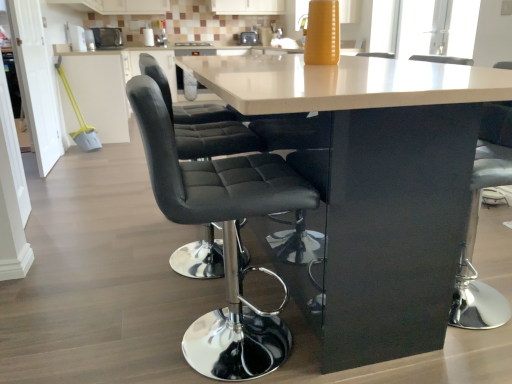
Describe the element at coordinates (374, 189) in the screenshot. Image resolution: width=512 pixels, height=384 pixels. I see `glossy black table at center` at that location.

Find the location of `metallic silver toaster at upper left, acting as the 2th appliance starting from the right`. metallic silver toaster at upper left, acting as the 2th appliance starting from the right is located at coordinates coord(106,37).

The width and height of the screenshot is (512, 384). What do you see at coordinates (100, 93) in the screenshot?
I see `white glossy cabinet at upper left` at bounding box center [100, 93].

The image size is (512, 384). Identify the location of white glossy counter at center. (109, 85).

Would you say white glossy cabinet at upper left contains black leather chair at center?

Actually, black leather chair at center is outside white glossy cabinet at upper left.

In the scene shown: From the image's perspective, which is below, white glossy cabinet at upper left or black leather chair at center?

black leather chair at center is shown below in the image.

From a real-world perspective, is white glossy cabinet at upper left below black leather chair at center?

Incorrect, from a real-world perspective, white glossy cabinet at upper left is higher than black leather chair at center.

Can you confirm if white glossy cabinet at upper left is positioned to the left of black leather chair at center?

Correct, you'll find white glossy cabinet at upper left to the left of black leather chair at center.

Based on the photo, how different are the orientations of white glossy counter at center and metallic silver toaster at center, placed as the 2th appliance when sorted from front to back, in degrees?

They differ by 0.157 degrees in their facing directions.

From a real-world perspective, is white glossy counter at center above or below metallic silver toaster at center, acting as the 1th appliance starting from the back?

In terms of real-world spatial position, white glossy counter at center is below metallic silver toaster at center, acting as the 1th appliance starting from the back.

Does white glossy counter at center touch metallic silver toaster at center, placed as the 2th appliance when sorted from front to back?

No.

Which is less distant, (68, 50) or (251, 38)?

Clearly, point (68, 50) is more distant from the camera than point (251, 38).

Does metallic silver toaster at center, arranged as the second appliance when viewed from the left, turn towards black leather chair at center?

Yes, metallic silver toaster at center, arranged as the second appliance when viewed from the left, is turned towards black leather chair at center.

Which appliance is the 1st one when counting from the left side of the black leather chair at center? Please provide its 2D coordinates.

[(249, 38)]

From the image's perspective, which one is positioned higher, metallic silver toaster at center, which is the first appliance from right to left, or black leather chair at center?

metallic silver toaster at center, which is the first appliance from right to left.

Is metallic silver toaster at center, which is the first appliance from right to left, next to black leather chair at center and touching it?

No, metallic silver toaster at center, which is the first appliance from right to left, is not touching black leather chair at center.

From the image's perspective, starting from the glossy black table at center, which appliance is the 2nd one above? Please provide its 2D coordinates.

[(249, 38)]

Which object is positioned more to the left, glossy black table at center or metallic silver toaster at center, which is the first appliance from right to left?

metallic silver toaster at center, which is the first appliance from right to left, is more to the left.

Considering the positions of points (470, 205) and (257, 40), is point (470, 205) closer to camera compared to point (257, 40)?

That is True.

Would you say metallic silver toaster at center, placed as the 2th appliance when sorted from front to back, is part of glossy black table at center's contents?

Definitely not — metallic silver toaster at center, placed as the 2th appliance when sorted from front to back, is not inside glossy black table at center.

From a real-world perspective, which object stands above the other?

metallic silver toaster at upper left, which appears as the first appliance when viewed from the front.

Is metallic silver toaster at upper left, acting as the 2th appliance starting from the right, oriented towards black leather chair at center?

No, metallic silver toaster at upper left, acting as the 2th appliance starting from the right, is not turned towards black leather chair at center.

Does metallic silver toaster at center, which is the first appliance from right to left, have a lesser width compared to white glossy cabinet at upper left?

Yes.

How far apart are metallic silver toaster at center, acting as the 1th appliance starting from the back, and white glossy cabinet at upper left?

metallic silver toaster at center, acting as the 1th appliance starting from the back, is 5.14 feet from white glossy cabinet at upper left.

Considering the sizes of objects metallic silver toaster at center, placed as the 2th appliance when sorted from front to back, and white glossy cabinet at upper left in the image provided, who is shorter, metallic silver toaster at center, placed as the 2th appliance when sorted from front to back, or white glossy cabinet at upper left?

metallic silver toaster at center, placed as the 2th appliance when sorted from front to back.

Is black leather chair at center aimed at white glossy counter at center?

No, black leather chair at center is not aimed at white glossy counter at center.

Can you confirm if black leather chair at center is positioned to the right of white glossy counter at center?

Correct, you'll find black leather chair at center to the right of white glossy counter at center.

Is black leather chair at center not close to white glossy counter at center?

Absolutely, black leather chair at center is distant from white glossy counter at center.

Locate an element on the screen. The image size is (512, 384). chair below the white glossy cabinet at upper left (from the image's perspective) is located at coordinates point(223,236).

Identify the location of counter that is in front of the metallic silver toaster at center, which is the first appliance from right to left. (109, 85).

Based on their spatial positions, is glossy black table at center or metallic silver toaster at upper left, the second appliance in the back-to-front sequence, further from white glossy cabinet at upper left?

glossy black table at center is further to white glossy cabinet at upper left.

When comparing their distances from metallic silver toaster at upper left, the second appliance in the back-to-front sequence, does white glossy counter at center or black leather chair at center seem closer?

The object closer to metallic silver toaster at upper left, the second appliance in the back-to-front sequence, is white glossy counter at center.

Consider the image. Based on their spatial positions, is black leather chair at center or glossy black table at center closer to metallic silver toaster at upper left, acting as the 2th appliance starting from the right?

black leather chair at center.

Estimate the real-world distances between objects in this image. Which object is closer to glossy black table at center, white glossy cabinet at upper left or black leather chair at center?

Based on the image, black leather chair at center appears to be nearer to glossy black table at center.

Which object lies further to the anchor point white glossy counter at center, metallic silver toaster at upper left, acting as the 2th appliance starting from the right, or metallic silver toaster at center, acting as the 1th appliance starting from the back?

metallic silver toaster at center, acting as the 1th appliance starting from the back, lies further to white glossy counter at center than the other object.

When comparing their distances from metallic silver toaster at upper left, the second appliance in the back-to-front sequence, does black leather chair at center or white glossy counter at center seem further?

black leather chair at center.

From the image, which object appears to be nearer to metallic silver toaster at center, placed as the 2th appliance when sorted from front to back, white glossy cabinet at upper left or glossy black table at center?

Based on the image, white glossy cabinet at upper left appears to be nearer to metallic silver toaster at center, placed as the 2th appliance when sorted from front to back.

Estimate the real-world distances between objects in this image. Which object is further from glossy black table at center, metallic silver toaster at center, placed as the 2th appliance when sorted from front to back, or white glossy cabinet at upper left?

white glossy cabinet at upper left lies further to glossy black table at center than the other object.

Locate an element on the screen. This screenshot has height=384, width=512. chair positioned between glossy black table at center and white glossy cabinet at upper left from near to far is located at coordinates (223, 236).

Locate an element on the screen. cabinetry located between black leather chair at center and metallic silver toaster at upper left, which appears as the first appliance when viewed from the front, in the depth direction is located at coordinates (100, 93).

Find the location of a particular element. counter positioned between black leather chair at center and metallic silver toaster at center, placed as the 2th appliance when sorted from front to back, from near to far is located at coordinates (109, 85).

The width and height of the screenshot is (512, 384). In order to click on cabinetry positioned between white glossy counter at center and metallic silver toaster at center, acting as the 1th appliance starting from the back, from near to far in this screenshot , I will do `click(100, 93)`.